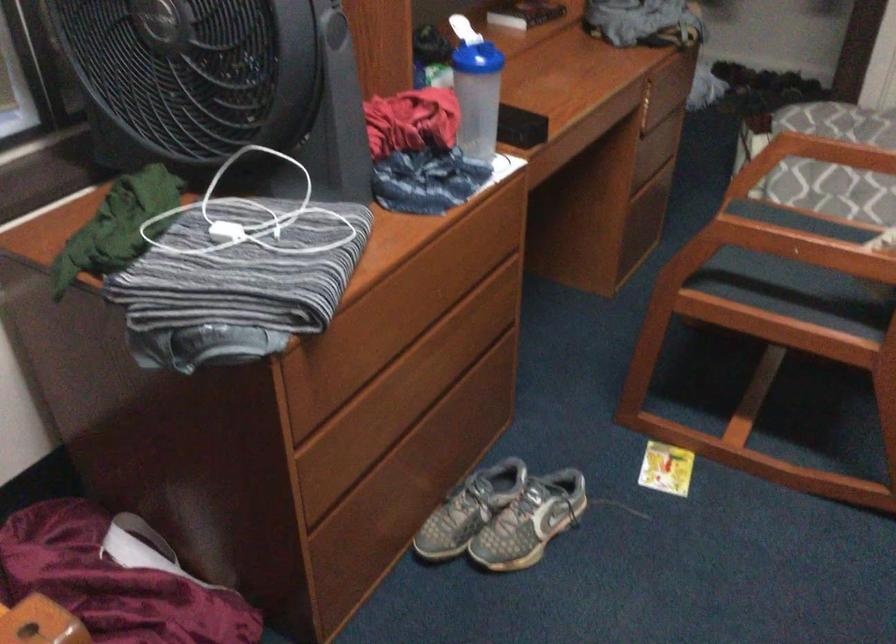
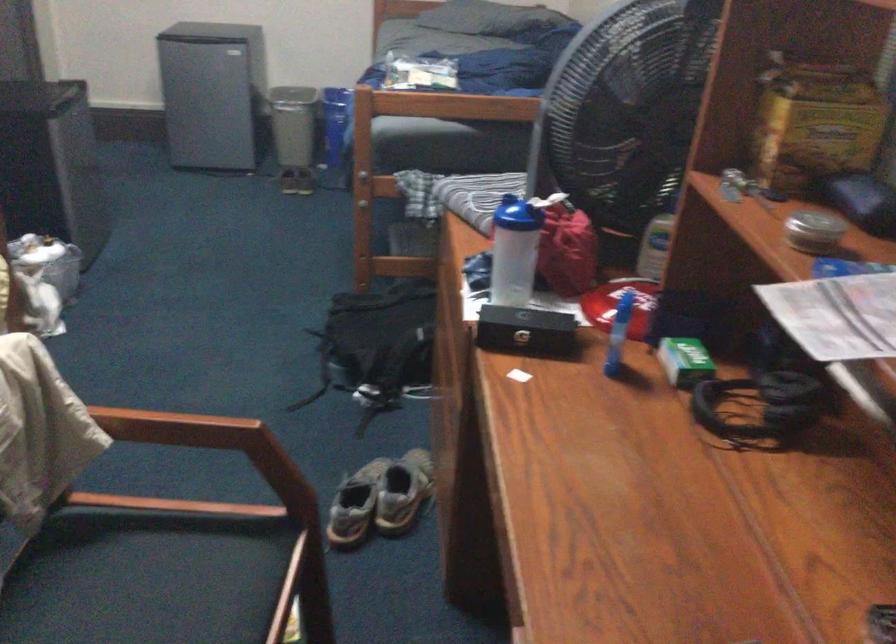
In the second image, find the point that corresponds to (x=509, y=109) in the first image.

(526, 330)